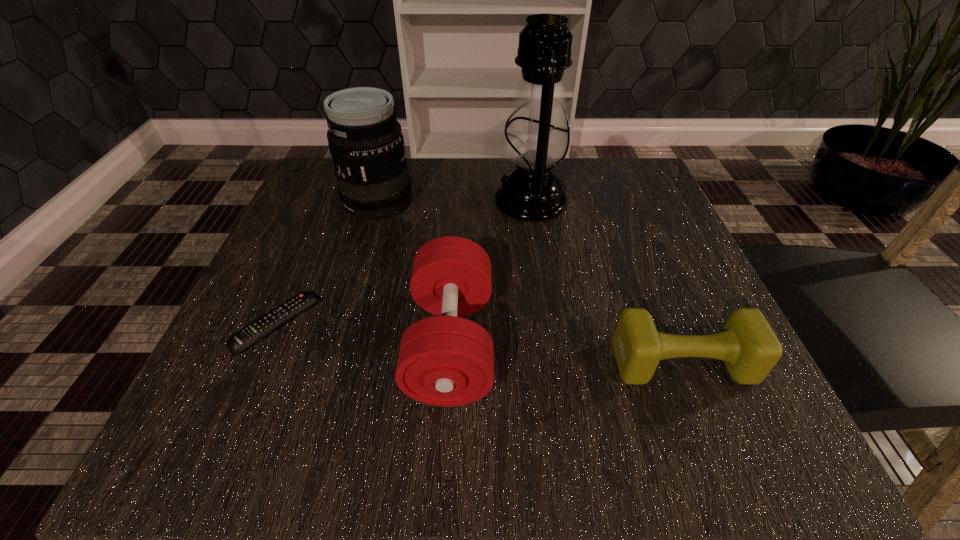
You are a GUI agent. You are given a task and a screenshot of the screen. Output one action in this format:
    pyautogui.click(x=<x>, y=<y>)
    Task: Click on the vacant region located 0.200m on the back of the taller dumbbell
    Image resolution: width=960 pixels, height=540 pixels.
    Given the screenshot: What is the action you would take?
    pyautogui.click(x=458, y=218)

You are a GUI agent. You are given a task and a screenshot of the screen. Output one action in this format:
    pyautogui.click(x=<x>, y=<y>)
    Task: Click on the vacant area situated 0.070m on the left of the second shortest object
    This screenshot has height=540, width=960.
    Given the screenshot: What is the action you would take?
    pyautogui.click(x=566, y=363)

Locate an element on the screen. free space located 0.360m on the back of the shortest object is located at coordinates (339, 178).

The height and width of the screenshot is (540, 960). Find the location of `oil lamp situated at the far edge`. oil lamp situated at the far edge is located at coordinates (536, 140).

Locate an element on the screen. telephoto lens located in the far edge section of the desktop is located at coordinates (365, 140).

Identify the location of object located in the near edge section of the desktop. (445, 360).

Find the location of a particular element. This screenshot has width=960, height=540. telephoto lens that is at the left edge is located at coordinates (365, 140).

Locate an element on the screen. remote control present at the left edge is located at coordinates (255, 331).

At what (x,y) coordinates should I click in order to perform the action: click on object situated at the right edge. Please return your answer as a coordinate pair (x, y). Looking at the image, I should click on (747, 345).

You are a GUI agent. You are given a task and a screenshot of the screen. Output one action in this format:
    pyautogui.click(x=<x>, y=<y>)
    Task: Click on the object at the far left corner
    Image resolution: width=960 pixels, height=540 pixels.
    Given the screenshot: What is the action you would take?
    pyautogui.click(x=365, y=140)